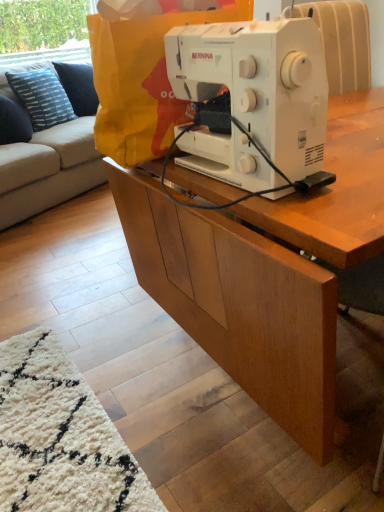
Question: Is wooden cabinet at center bigger than yellow paper bag at center?

Choices:
 (A) no
 (B) yes

Answer: (B)

Question: Is wooden cabinet at center not within yellow paper bag at center?

Choices:
 (A) yes
 (B) no

Answer: (A)

Question: Is wooden cabinet at center at the right side of yellow paper bag at center?

Choices:
 (A) no
 (B) yes

Answer: (A)

Question: Does wooden cabinet at center have a lesser width compared to yellow paper bag at center?

Choices:
 (A) yes
 (B) no

Answer: (B)

Question: From the image's perspective, would you say wooden cabinet at center is shown under yellow paper bag at center?

Choices:
 (A) yes
 (B) no

Answer: (A)

Question: Looking at their shapes, would you say light gray fabric couch at upper left is wider or thinner than white plastic sewing machine at center?

Choices:
 (A) wide
 (B) thin

Answer: (A)

Question: In the image, is light gray fabric couch at upper left on the left side or the right side of white plastic sewing machine at center?

Choices:
 (A) right
 (B) left

Answer: (B)

Question: Looking at the image, does light gray fabric couch at upper left seem bigger or smaller compared to white plastic sewing machine at center?

Choices:
 (A) small
 (B) big

Answer: (B)

Question: Considering the positions of point (76, 168) and point (268, 94), is point (76, 168) closer or farther from the camera than point (268, 94)?

Choices:
 (A) farther
 (B) closer

Answer: (A)

Question: In the image, is white plastic sewing machine at center on the left side or the right side of wooden cabinet at center?

Choices:
 (A) right
 (B) left

Answer: (A)

Question: From a real-world perspective, is white plastic sewing machine at center positioned above or below wooden cabinet at center?

Choices:
 (A) above
 (B) below

Answer: (A)

Question: In the image, is white plastic sewing machine at center positioned in front of or behind wooden cabinet at center?

Choices:
 (A) behind
 (B) front

Answer: (B)

Question: Looking at their shapes, would you say white plastic sewing machine at center is wider or thinner than wooden cabinet at center?

Choices:
 (A) wide
 (B) thin

Answer: (B)

Question: From the image's perspective, is white plastic sewing machine at center above or below blue striped fabric pillow at upper left?

Choices:
 (A) below
 (B) above

Answer: (A)

Question: Is point (195, 145) closer or farther from the camera than point (24, 74)?

Choices:
 (A) closer
 (B) farther

Answer: (A)